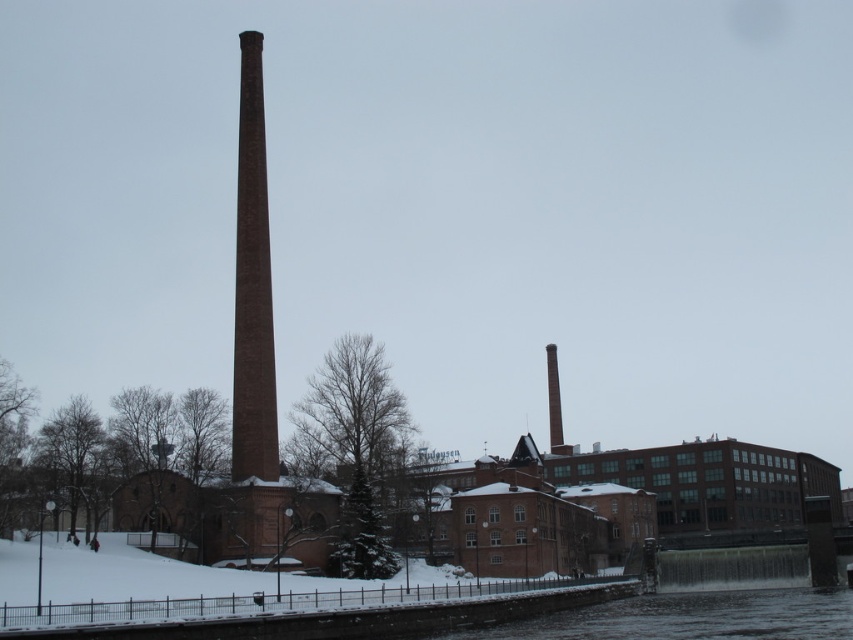
Based on the photo, you are a drone operator tasked with flying a drone between the brown brick chimney at center and the smooth brick chimney at center. The drone has a maximum flight distance of 250 feet. Can the drone safely make the trip between them without running out of battery?

The distance between the brown brick chimney at center and the smooth brick chimney at center is 300.41 feet, which exceeds the drone maximum flight distance of 250 feet. The drone cannot safely make the trip between them without running out of battery.

You are an architect analyzing the industrial scene. You need to determine which chimney has a greater width between the brown brick chimney at center and the smooth brick chimney at center. According to the scene description, which one is wider?

The brown brick chimney at center is wider than the smooth brick chimney at center as stated in the Objects Description.